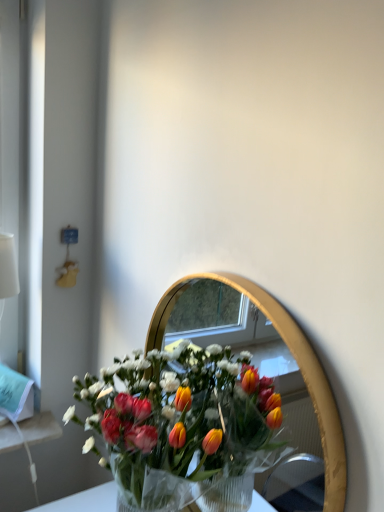
Question: Is translucent plastic bouquet at center looking in the opposite direction of gold metallic mirror at center?

Choices:
 (A) yes
 (B) no

Answer: (A)

Question: Is translucent plastic bouquet at center further to the viewer compared to gold metallic mirror at center?

Choices:
 (A) yes
 (B) no

Answer: (A)

Question: Can you confirm if translucent plastic bouquet at center is taller than gold metallic mirror at center?

Choices:
 (A) no
 (B) yes

Answer: (A)

Question: Considering the relative sizes of translucent plastic bouquet at center and gold metallic mirror at center in the image provided, is translucent plastic bouquet at center smaller than gold metallic mirror at center?

Choices:
 (A) no
 (B) yes

Answer: (A)

Question: Are translucent plastic bouquet at center and gold metallic mirror at center making contact?

Choices:
 (A) no
 (B) yes

Answer: (A)

Question: Can you confirm if translucent plastic bouquet at center is shorter than gold metallic mirror at center?

Choices:
 (A) no
 (B) yes

Answer: (B)

Question: Is gold metallic mirror at center positioned before translucent plastic bouquet at center?

Choices:
 (A) no
 (B) yes

Answer: (B)

Question: Considering the relative sizes of gold metallic mirror at center and translucent plastic bouquet at center in the image provided, is gold metallic mirror at center thinner than translucent plastic bouquet at center?

Choices:
 (A) yes
 (B) no

Answer: (A)

Question: Does gold metallic mirror at center appear on the right side of translucent plastic bouquet at center?

Choices:
 (A) no
 (B) yes

Answer: (B)

Question: Is gold metallic mirror at center aimed at translucent plastic bouquet at center?

Choices:
 (A) no
 (B) yes

Answer: (B)

Question: Does gold metallic mirror at center touch translucent plastic bouquet at center?

Choices:
 (A) yes
 (B) no

Answer: (B)

Question: Is gold metallic mirror at center facing away from translucent plastic bouquet at center?

Choices:
 (A) yes
 (B) no

Answer: (A)

Question: From a real-world perspective, relative to gold metallic mirror at center, is translucent plastic bouquet at center vertically above or below?

Choices:
 (A) below
 (B) above

Answer: (A)